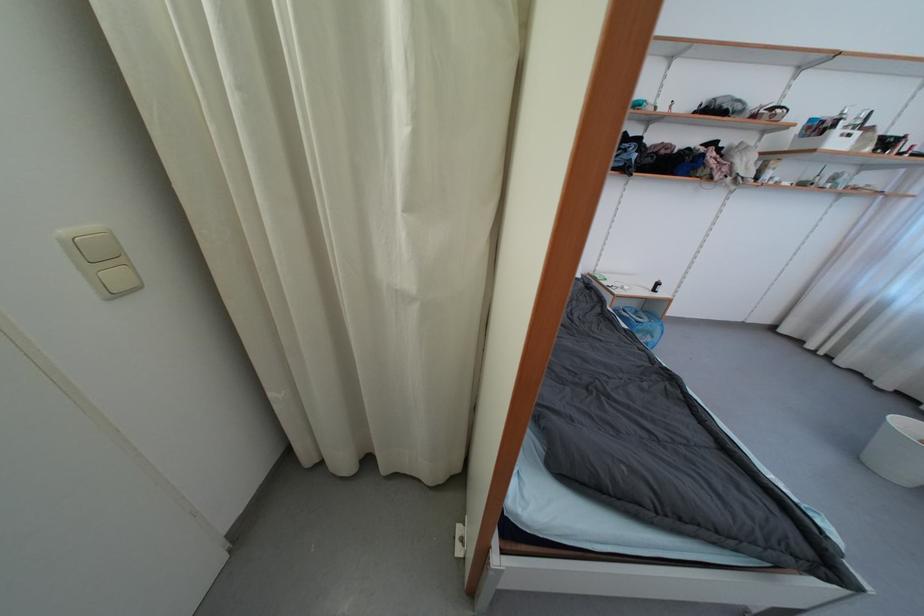
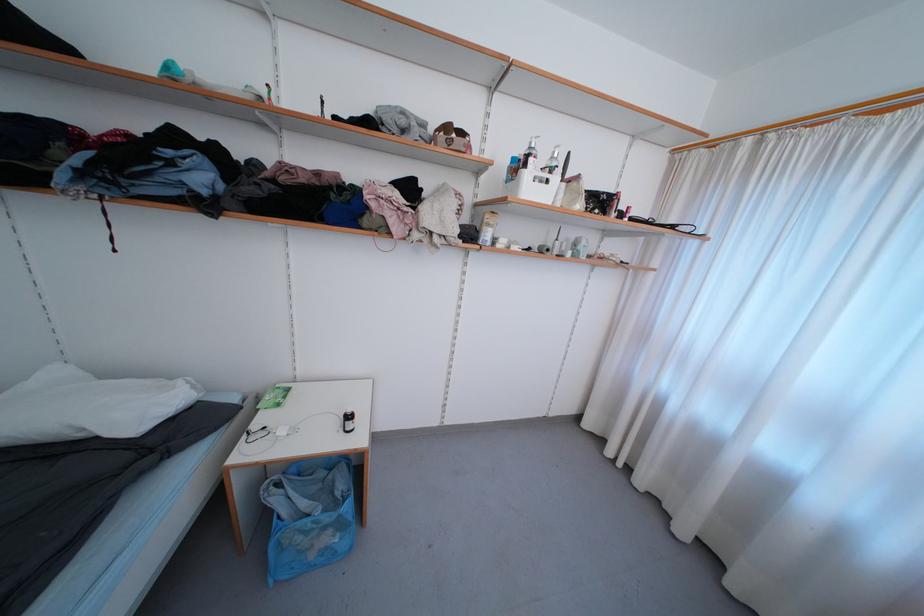
Which direction would the cameraman need to move to produce the second image?

The cameraman walked toward right, forward.